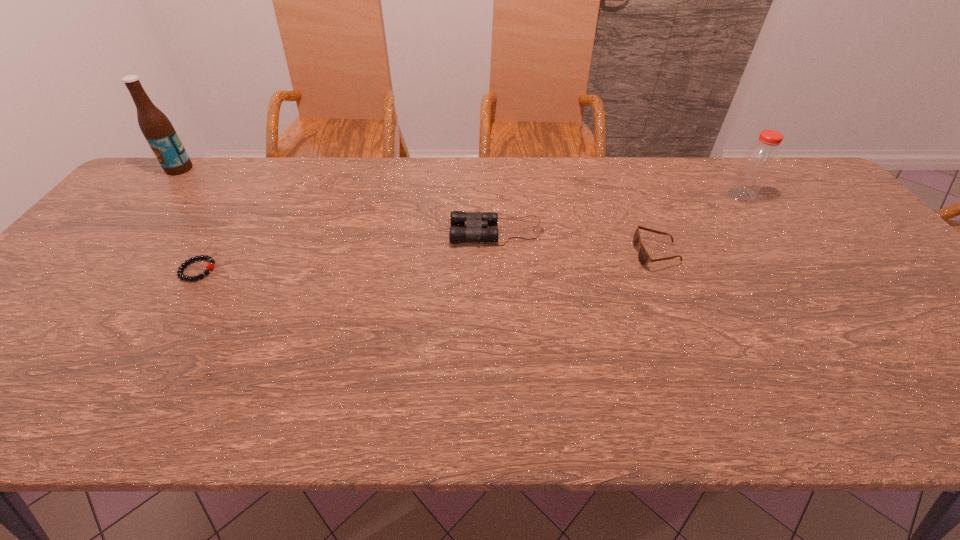
This screenshot has width=960, height=540. Find the location of `object located in the far left corner section of the desktop`. object located in the far left corner section of the desktop is located at coordinates (157, 129).

Find the location of a particular element. Image resolution: width=960 pixels, height=540 pixels. vacant region at the far edge of the desktop is located at coordinates (670, 192).

This screenshot has height=540, width=960. In order to click on free region at the near edge in this screenshot , I will do `click(575, 384)`.

What are the coordinates of `free region at the left edge of the desktop` in the screenshot? It's located at (92, 288).

The width and height of the screenshot is (960, 540). What are the coordinates of `vacant space at the far left corner of the desktop` in the screenshot? It's located at (159, 197).

You are a GUI agent. You are given a task and a screenshot of the screen. Output one action in this format:
    pyautogui.click(x=<x>, y=<y>)
    Task: Click on the empty space between the binoculars and the beer bottle
    The height and width of the screenshot is (540, 960).
    Given the screenshot: What is the action you would take?
    pyautogui.click(x=338, y=200)

Locate an element on the screen. free point between the bottle and the binoculars is located at coordinates (619, 214).

Identify the location of vacant space that is in between the third object from right to left and the sunglasses. (577, 242).

You are a GUI agent. You are given a task and a screenshot of the screen. Output one action in this format:
    pyautogui.click(x=<x>, y=<y>)
    Task: Click on the free spot between the sunglasses and the bottle
    
    Given the screenshot: What is the action you would take?
    pyautogui.click(x=699, y=224)

This screenshot has width=960, height=540. Identify the location of free space that is in between the third object from left to right and the leftmost object. (338, 200).